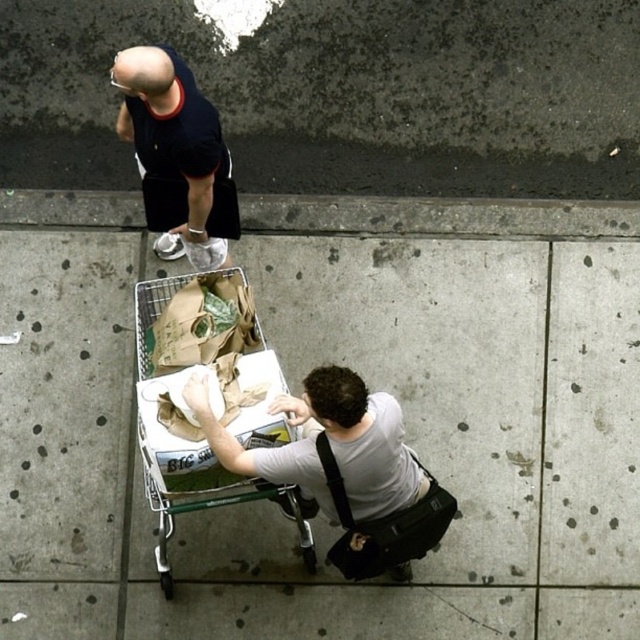
You are standing at point (x=522, y=230) and want to throw a ball to someone standing at point 0.423, 0.689. Given that the maximum throwing distance you can achieve is 5 meters, will you be able to reach them?

The distance between the two points is 5.53 meters, which exceeds your maximum throwing distance of 5 meters. Therefore, you will not be able to reach them.

In the scene shown: You are designing a clothing catalog and need to place two shirts side by side. Given the black matte shirt at upper left and the white matte shirt at lower center, which one should you choose if you want the shirt with the smaller width for the catalog layout?

The black matte shirt at upper left has a smaller width than the white matte shirt at lower center, so it should be chosen for the catalog layout requiring a narrower shirt.

Based on the scene description, what object is located at the coordinate point marked as point (179, 433)?

The metallic silver shopping cart at center is located at the coordinate point marked as point (179, 433).